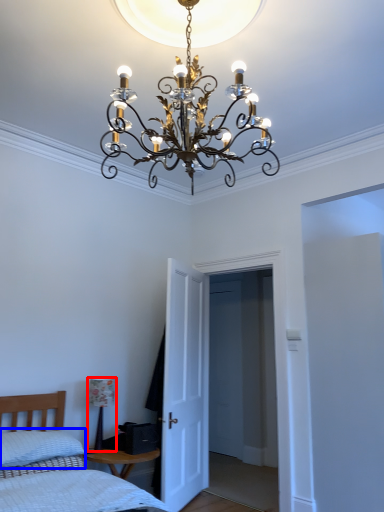
Question: Which of the following is the farthest to the observer, lamp (highlighted by a red box) or pillow (highlighted by a blue box)?

Choices:
 (A) lamp
 (B) pillow

Answer: (A)